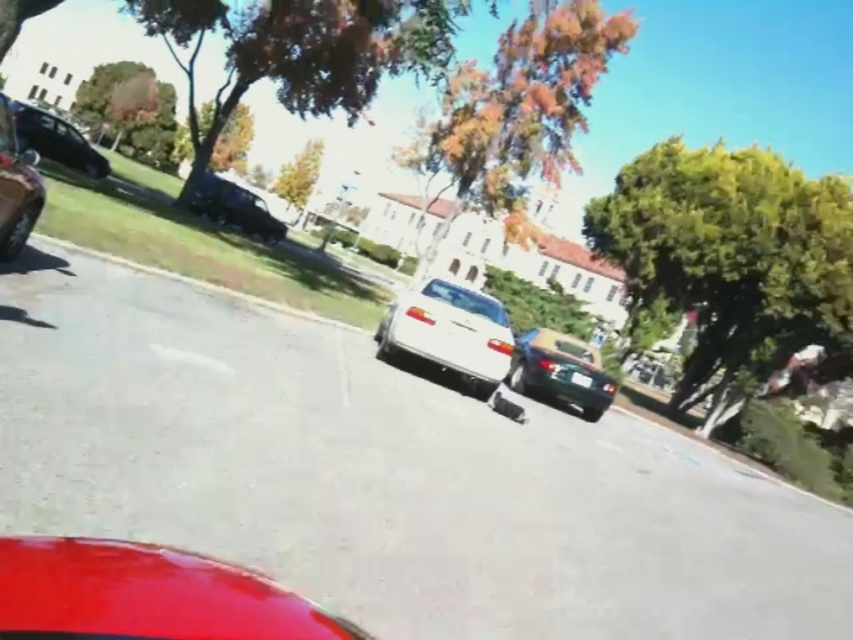
Question: Which of the following is the closest to the observer?

Choices:
 (A) black plastic license plate at center
 (B) gray asphalt curb at lower center

Answer: (B)

Question: Does metallic green car at center appear over black plastic license plate at center?

Choices:
 (A) no
 (B) yes

Answer: (B)

Question: Can you confirm if white glossy sedan at center is smaller than shiny black sedan at center?

Choices:
 (A) no
 (B) yes

Answer: (B)

Question: Which point appears closest to the camera in this image?

Choices:
 (A) (65, 132)
 (B) (73, 564)

Answer: (B)

Question: Is glossy red car at lower left above black plastic license plate at center?

Choices:
 (A) yes
 (B) no

Answer: (A)

Question: Which object is positioned farthest from the shiny black sedan at upper left?

Choices:
 (A) glossy red car at lower left
 (B) shiny black car at left

Answer: (A)